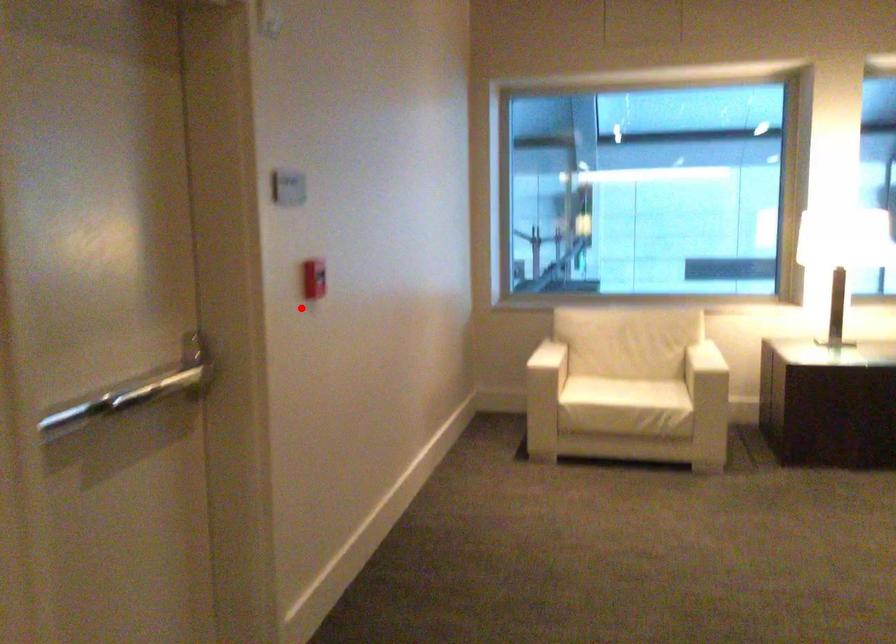
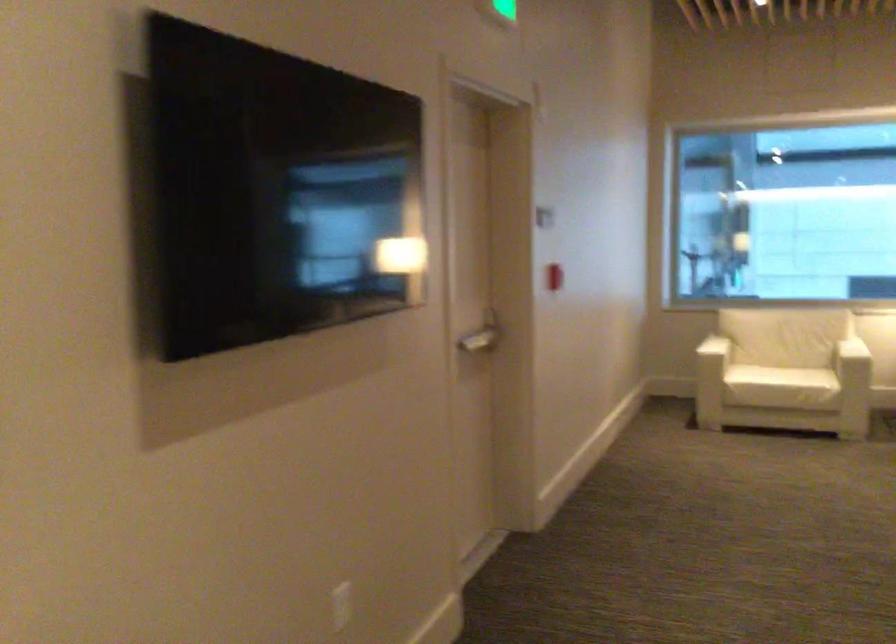
The point at the highlighted location is marked in the first image. Where is the corresponding point in the second image?

(554, 277)